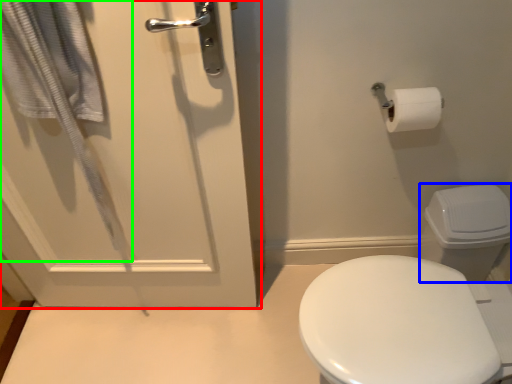
Question: Based on their relative distances, which object is nearer to door (highlighted by a red box)? Choose from toilet bowl (highlighted by a blue box) and bath towel (highlighted by a green box).

Choices:
 (A) toilet bowl
 (B) bath towel

Answer: (B)